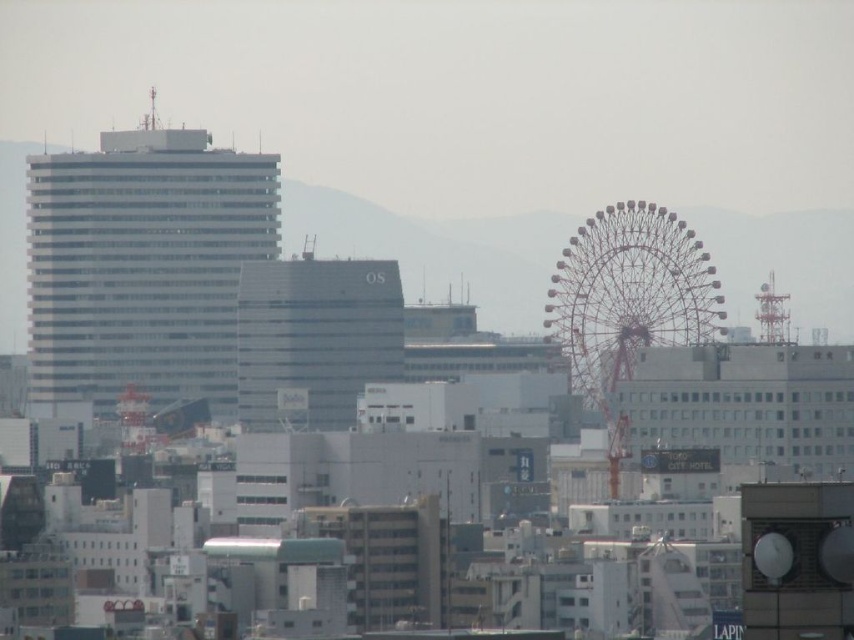
Question: Can you confirm if matte gray building at center is smaller than metallic silver ferris wheel at right?

Choices:
 (A) no
 (B) yes

Answer: (B)

Question: Which of the following is the closest to the observer?

Choices:
 (A) (589, 308)
 (B) (335, 300)
 (C) (192, 305)

Answer: (B)

Question: Is white glass building at left in front of metallic silver ferris wheel at right?

Choices:
 (A) yes
 (B) no

Answer: (B)

Question: Which object is positioned closest to the white glass building at left?

Choices:
 (A) matte gray building at center
 (B) metallic silver ferris wheel at right

Answer: (A)

Question: Which object is closer to the camera taking this photo?

Choices:
 (A) white glass building at left
 (B) metallic silver ferris wheel at right

Answer: (B)

Question: Is white glass building at left to the right of matte gray building at center from the viewer's perspective?

Choices:
 (A) yes
 (B) no

Answer: (B)